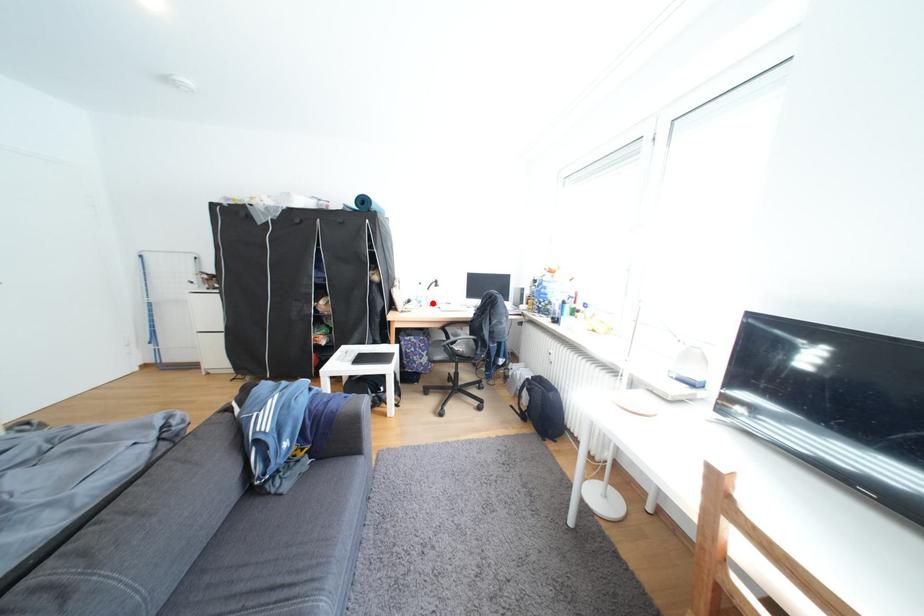
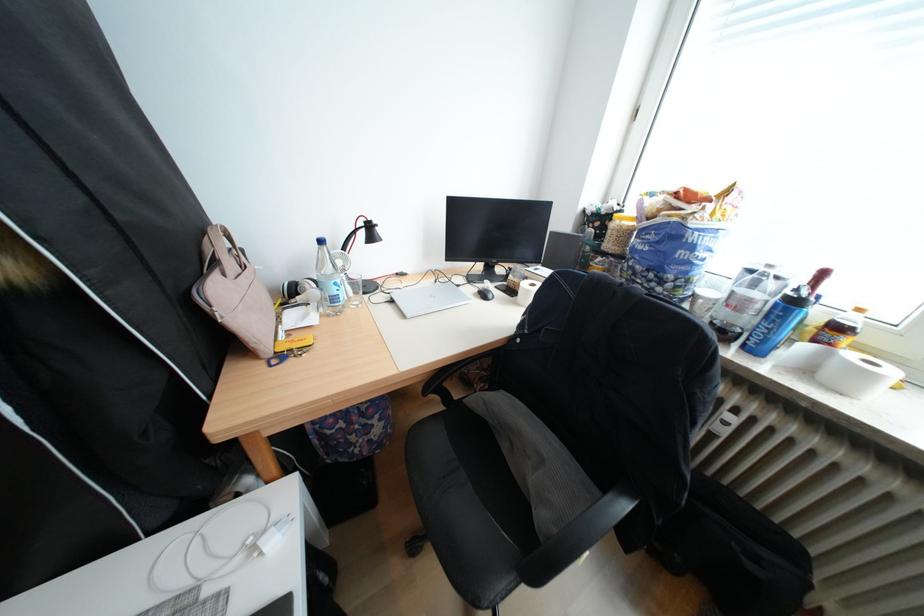
In the second image, find the point that corresponds to the highlighted location in the first image.

(346, 300)